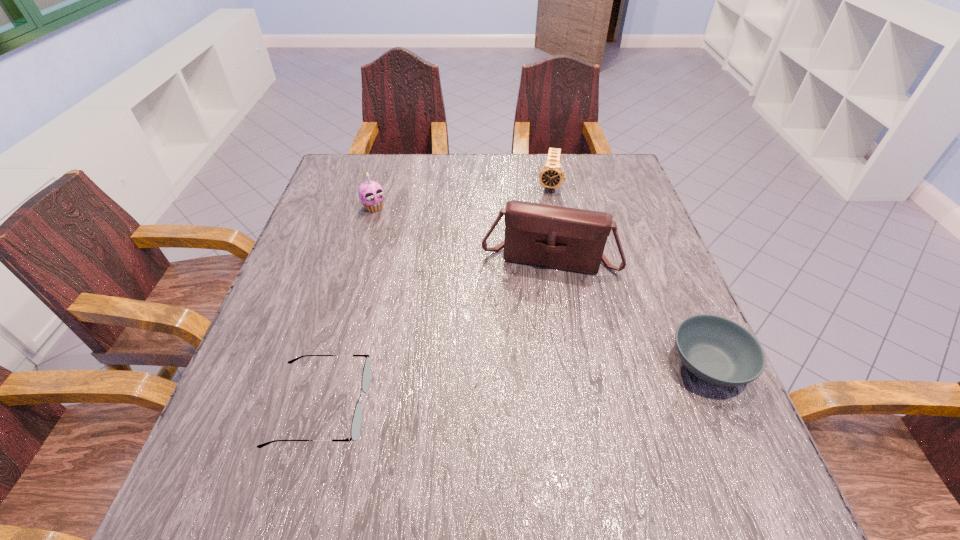
Identify the location of vacant space situated on the face of the watch. (532, 295).

Locate an element on the screen. This screenshot has height=540, width=960. vacant area situated 0.360m on the face of the second farthest object is located at coordinates pyautogui.click(x=446, y=295).

The height and width of the screenshot is (540, 960). Find the location of `free space located 0.070m on the face of the second farthest object`. free space located 0.070m on the face of the second farthest object is located at coordinates (390, 227).

Identify the location of vacant space located on the face of the second farthest object. The image size is (960, 540). (402, 242).

Where is `vacant space located on the front flap of the shoulder bag`? This screenshot has width=960, height=540. vacant space located on the front flap of the shoulder bag is located at coordinates (527, 347).

This screenshot has height=540, width=960. In order to click on free space located 0.140m on the front flap of the shoulder bag in this screenshot , I will do `click(531, 325)`.

Find the location of a particular element. Image resolution: width=960 pixels, height=540 pixels. vacant area located 0.250m on the front flap of the shoulder bag is located at coordinates [524, 368].

This screenshot has width=960, height=540. What are the coordinates of `object that is at the far edge` in the screenshot? It's located at (551, 175).

Where is `spectacles positioned at the near edge`? spectacles positioned at the near edge is located at coordinates (366, 375).

Locate an element on the screen. The image size is (960, 540). soup bowl positioned at the near edge is located at coordinates (717, 350).